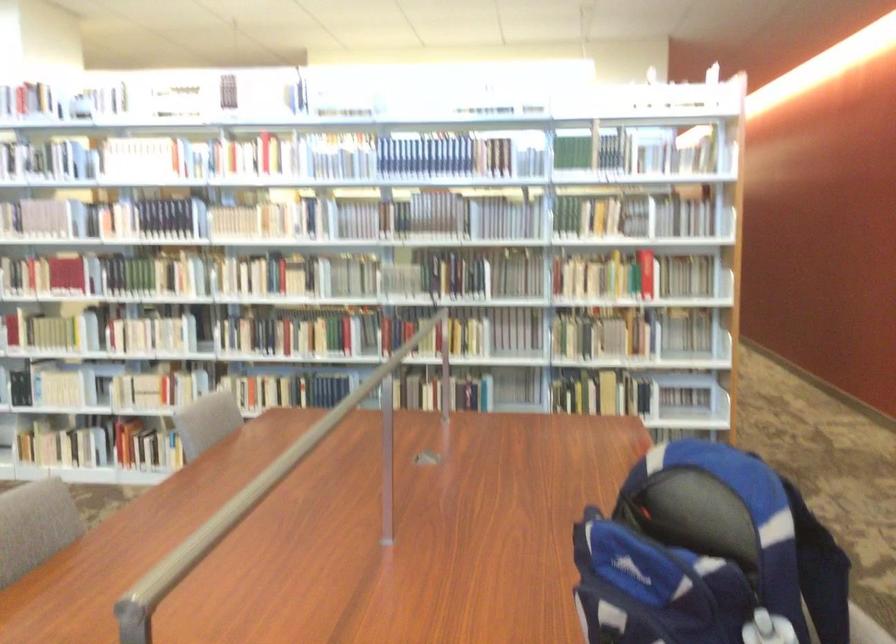
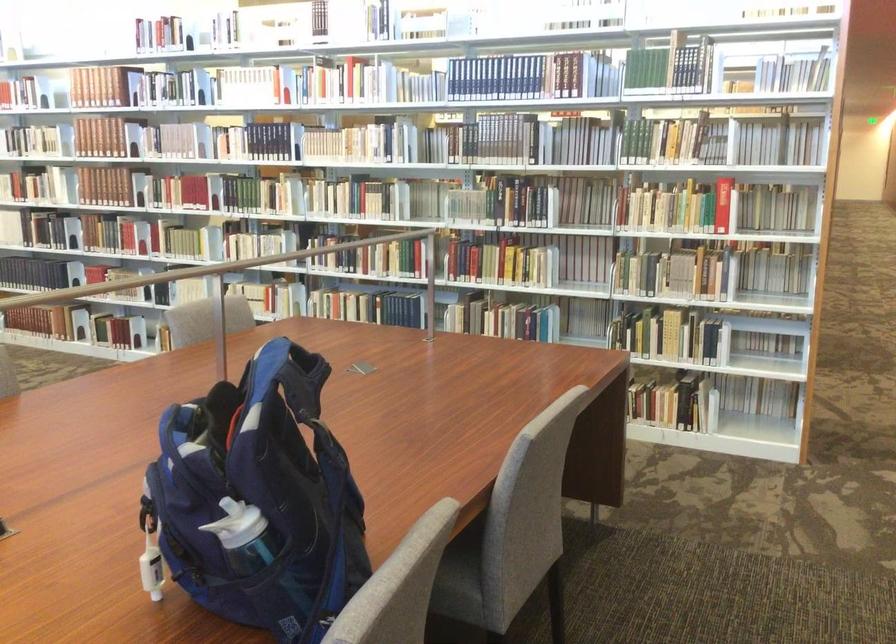
Question: The camera is either moving clockwise (left) or counter-clockwise (right) around the object. The first image is from the beginning of the video and the second image is from the end. Is the camera moving left or right when shooting the video?

Choices:
 (A) Left
 (B) Right

Answer: (B)